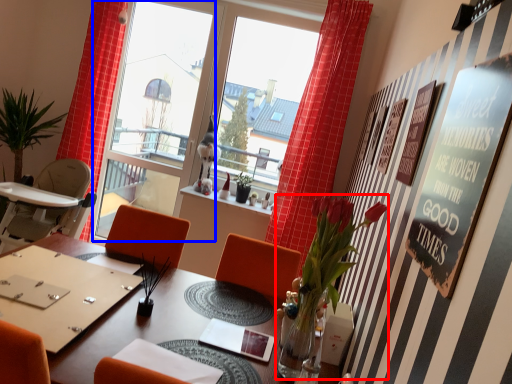
Question: Which object is closer to the camera taking this photo, plant (highlighted by a red box) or window screen (highlighted by a blue box)?

Choices:
 (A) plant
 (B) window screen

Answer: (A)